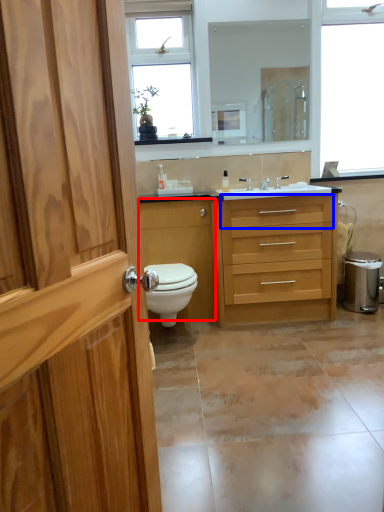
Question: Which point is closer to the camera, cabinetry (highlighted by a red box) or drawer (highlighted by a blue box)?

Choices:
 (A) cabinetry
 (B) drawer

Answer: (B)